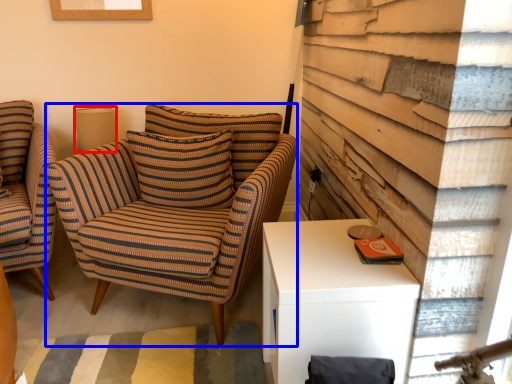
Question: Which point is closer to the camera, lamp (highlighted by a red box) or chair (highlighted by a blue box)?

Choices:
 (A) lamp
 (B) chair

Answer: (B)